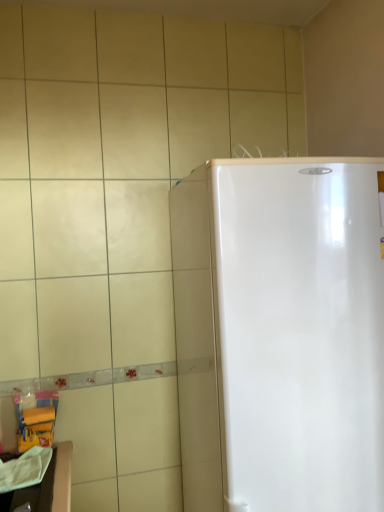
The height and width of the screenshot is (512, 384). What do you see at coordinates (280, 333) in the screenshot?
I see `white glossy refrigerator at right` at bounding box center [280, 333].

What is the approximate height of white glossy refrigerator at right?

The height of white glossy refrigerator at right is 4.46 feet.

This screenshot has height=512, width=384. I want to click on white glossy refrigerator at right, so click(280, 333).

What do you see at coordinates (47, 486) in the screenshot?
I see `white glossy counter top at lower left` at bounding box center [47, 486].

Where is `white glossy counter top at lower left`? white glossy counter top at lower left is located at coordinates (47, 486).

Locate an element on the screen. white glossy refrigerator at right is located at coordinates (280, 333).

Based on the photo, which is more to the right, white glossy counter top at lower left or white glossy refrigerator at right?

white glossy refrigerator at right.

Is white glossy counter top at lower left positioned behind white glossy refrigerator at right?

Yes, it is.

Considering the positions of points (16, 455) and (376, 174), is point (16, 455) closer to camera compared to point (376, 174)?

No, it is not.

From the image's perspective, which one is positioned higher, white glossy counter top at lower left or white glossy refrigerator at right?

From the image's view, white glossy refrigerator at right is above.

From a real-world perspective, which is physically below, white glossy counter top at lower left or white glossy refrigerator at right?

white glossy counter top at lower left, from a real-world perspective.

In terms of width, does white glossy counter top at lower left look wider or thinner when compared to white glossy refrigerator at right?

Clearly, white glossy counter top at lower left has less width compared to white glossy refrigerator at right.

Is white glossy counter top at lower left taller than white glossy refrigerator at right?

No.

Which of these two, white glossy counter top at lower left or white glossy refrigerator at right, is smaller?

Smaller between the two is white glossy counter top at lower left.

Is white glossy refrigerator at right a part of white glossy counter top at lower left?

No, white glossy counter top at lower left does not contain white glossy refrigerator at right.

Is white glossy counter top at lower left far away from white glossy refrigerator at right?

No, white glossy counter top at lower left is in close proximity to white glossy refrigerator at right.

Is white glossy refrigerator at right at the back of white glossy counter top at lower left?

That's not correct — white glossy counter top at lower left is not looking away from white glossy refrigerator at right.

How many degrees apart are the facing directions of white glossy counter top at lower left and white glossy refrigerator at right?

There is a 83.8-degree angle between the facing directions of white glossy counter top at lower left and white glossy refrigerator at right.

Image resolution: width=384 pixels, height=512 pixels. Find the location of `counter top below the white glossy refrigerator at right (from the image's perspective)`. counter top below the white glossy refrigerator at right (from the image's perspective) is located at coordinates (47, 486).

Considering the relative positions of white glossy refrigerator at right and white glossy counter top at lower left in the image provided, is white glossy refrigerator at right to the left of white glossy counter top at lower left from the viewer's perspective?

Result: Incorrect, white glossy refrigerator at right is not on the left side of white glossy counter top at lower left.

Which object is further away from the camera taking this photo, white glossy refrigerator at right or white glossy counter top at lower left?

white glossy counter top at lower left is further from the camera.

Consider the image. Which is less distant, (290, 470) or (46, 488)?

Point (290, 470) is closer to the camera than point (46, 488).

From the image's perspective, is white glossy refrigerator at right over white glossy counter top at lower left?

Yes, from the image's perspective, white glossy refrigerator at right is above white glossy counter top at lower left.

Based on the photo, from a real-world perspective, is white glossy refrigerator at right below white glossy counter top at lower left?

Incorrect, from a real-world perspective, white glossy refrigerator at right is higher than white glossy counter top at lower left.

Which object is wider, white glossy refrigerator at right or white glossy counter top at lower left?

white glossy refrigerator at right.

Which of these two, white glossy refrigerator at right or white glossy counter top at lower left, stands taller?

white glossy refrigerator at right is taller.

Who is bigger, white glossy refrigerator at right or white glossy counter top at lower left?

white glossy refrigerator at right is bigger.

Which is correct: white glossy refrigerator at right is inside white glossy counter top at lower left, or outside of it?

white glossy refrigerator at right is spatially situated outside white glossy counter top at lower left.

Are white glossy refrigerator at right and white glossy counter top at lower left far apart?

Actually, white glossy refrigerator at right and white glossy counter top at lower left are a little close together.

From the picture: Is white glossy refrigerator at right positioned with its back to white glossy counter top at lower left?

No.

Find the location of a particular element. This screenshot has width=384, height=512. refrigerator above the white glossy counter top at lower left (from a real-world perspective) is located at coordinates (280, 333).

The width and height of the screenshot is (384, 512). In order to click on counter top lying below the white glossy refrigerator at right (from the image's perspective) in this screenshot , I will do `click(47, 486)`.

In the image, there is a white glossy counter top at lower left. Identify the location of refrigerator above it (from the image's perspective). The height and width of the screenshot is (512, 384). [x=280, y=333].